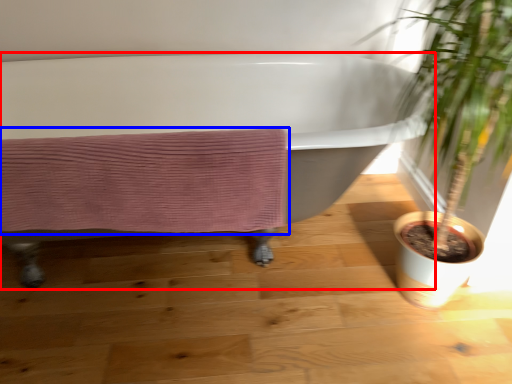
Question: Which point is further to the camera, bathtub (highlighted by a red box) or bath towel (highlighted by a blue box)?

Choices:
 (A) bathtub
 (B) bath towel

Answer: (B)